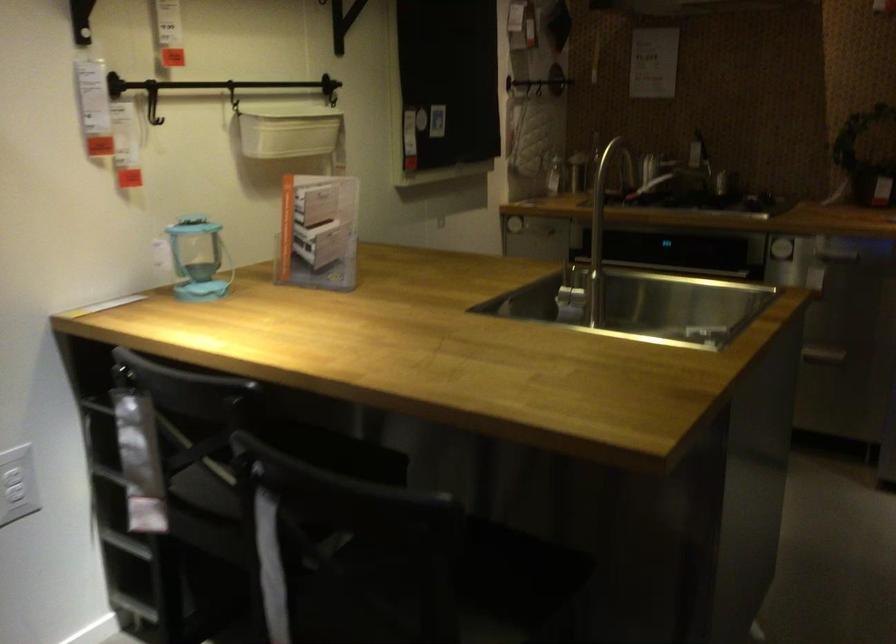
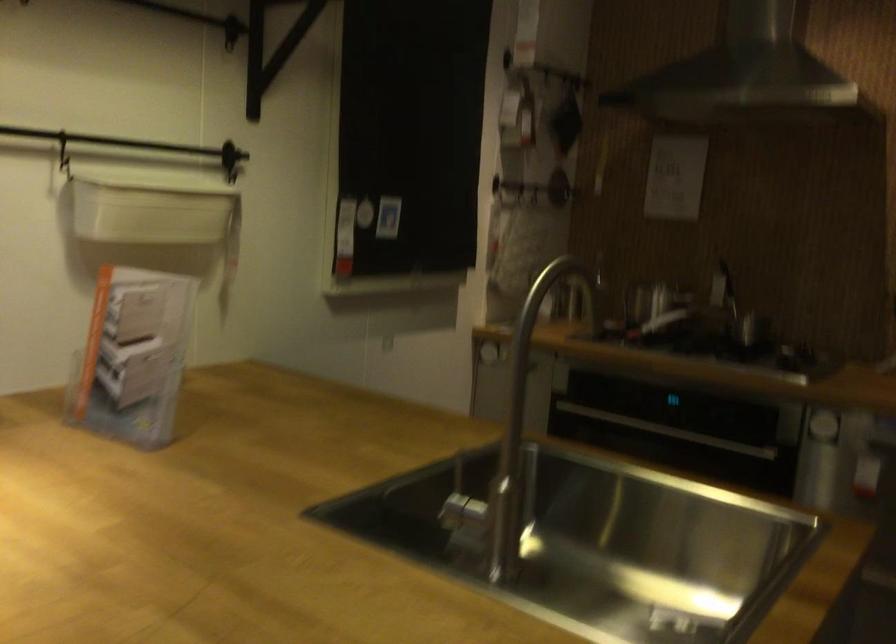
Question: The images are taken continuously from a first-person perspective. In which direction are you moving?

Choices:
 (A) Left
 (B) Right
 (C) Forward
 (D) Backward

Answer: (C)